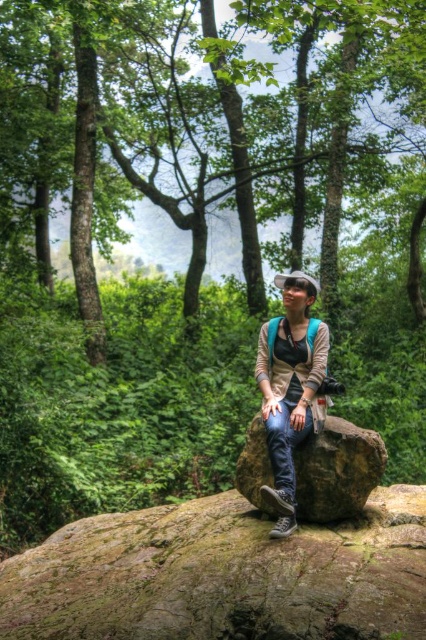
Question: Can you confirm if green leafy tree at center is positioned above brown rough rock at center?

Choices:
 (A) no
 (B) yes

Answer: (B)

Question: Does green leafy tree at center appear under brown rough rock at center?

Choices:
 (A) yes
 (B) no

Answer: (B)

Question: Can you confirm if green leafy tree at center is positioned to the right of brown rough rock at center?

Choices:
 (A) yes
 (B) no

Answer: (B)

Question: Which object appears farthest from the camera in this image?

Choices:
 (A) matte beige sweater at center
 (B) green leafy tree at center

Answer: (B)

Question: Which point appears closest to the camera in this image?

Choices:
 (A) pos(362,476)
 (B) pos(319,365)

Answer: (A)

Question: Estimate the real-world distances between objects in this image. Which object is farther from the matte beige sweater at center?

Choices:
 (A) brown rough rock at center
 (B) green leafy tree at center

Answer: (B)